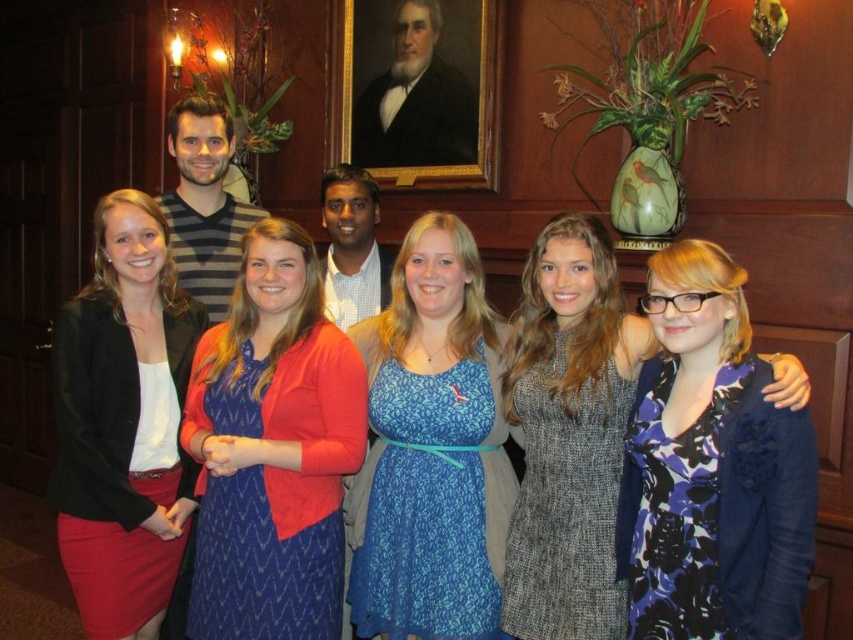
Can you confirm if blue textured dress at center is positioned below blue lace dress at center?

Actually, blue textured dress at center is above blue lace dress at center.

Can you confirm if blue textured dress at center is smaller than blue lace dress at center?

Yes.

Is point (256, 253) positioned before point (392, 589)?

No, it is not.

Locate an element on the screen. The height and width of the screenshot is (640, 853). blue textured dress at center is located at coordinates (271, 449).

Does point (199, 602) come in front of point (132, 256)?

That is True.

Can you confirm if blue textured dress at center is positioned below matte black blazer at left?

Actually, blue textured dress at center is above matte black blazer at left.

Is point (351, 424) positioned before point (140, 376)?

Yes, it is.

Where is `blue textured dress at center`? The width and height of the screenshot is (853, 640). blue textured dress at center is located at coordinates (271, 449).

Between blue lace dress at center and blue floral dress at center, which one has more height?

Standing taller between the two is blue lace dress at center.

Is blue lace dress at center to the right of blue floral dress at center from the viewer's perspective?

In fact, blue lace dress at center is to the left of blue floral dress at center.

Is point (495, 540) farther from viewer compared to point (585, 477)?

Yes.

In order to click on blue lace dress at center in this screenshot , I will do `click(430, 449)`.